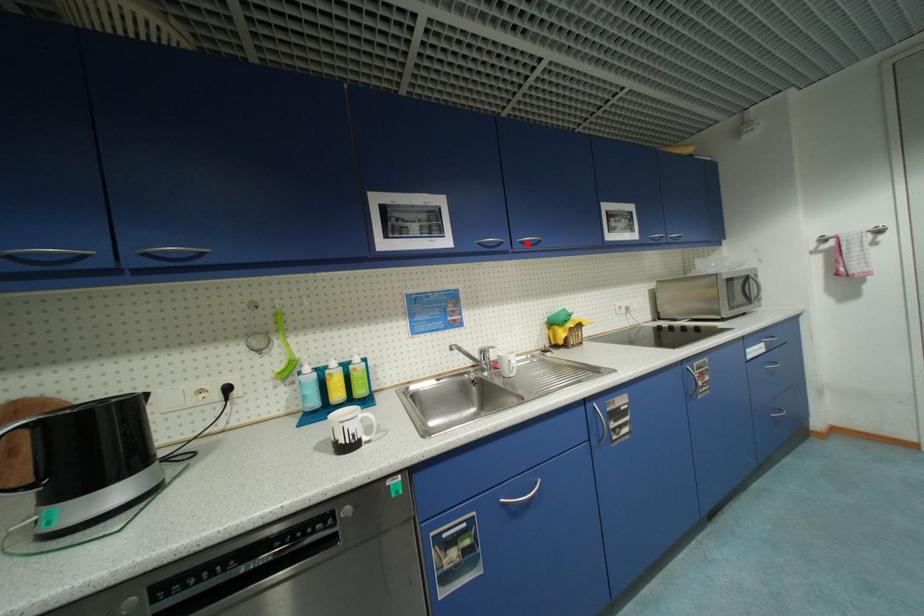
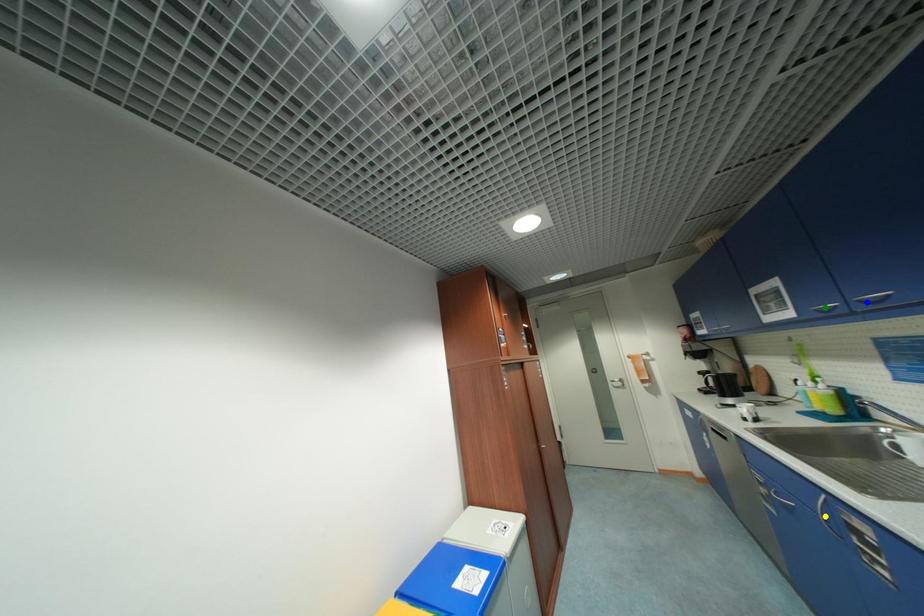
Question: I am providing you with two images of the same scene from different viewpoints. A red point is marked on the first image. You are given multiple points on the second image. Which point in image 2 is actually the same real-world point as the red point in image 1?

Choices:
 (A) yellow point
 (B) green point
 (C) blue point

Answer: (C)